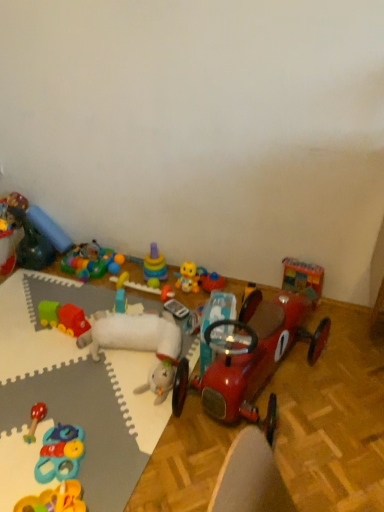
Where is `free space that is in between rubber green and red train at lower left, positioned as the ninth toy in right-to-left order, and rubberized plastic toy at lower left, placed as the 7th toy when sorted from left to right`? This screenshot has height=512, width=384. free space that is in between rubber green and red train at lower left, positioned as the ninth toy in right-to-left order, and rubberized plastic toy at lower left, placed as the 7th toy when sorted from left to right is located at coordinates (65, 381).